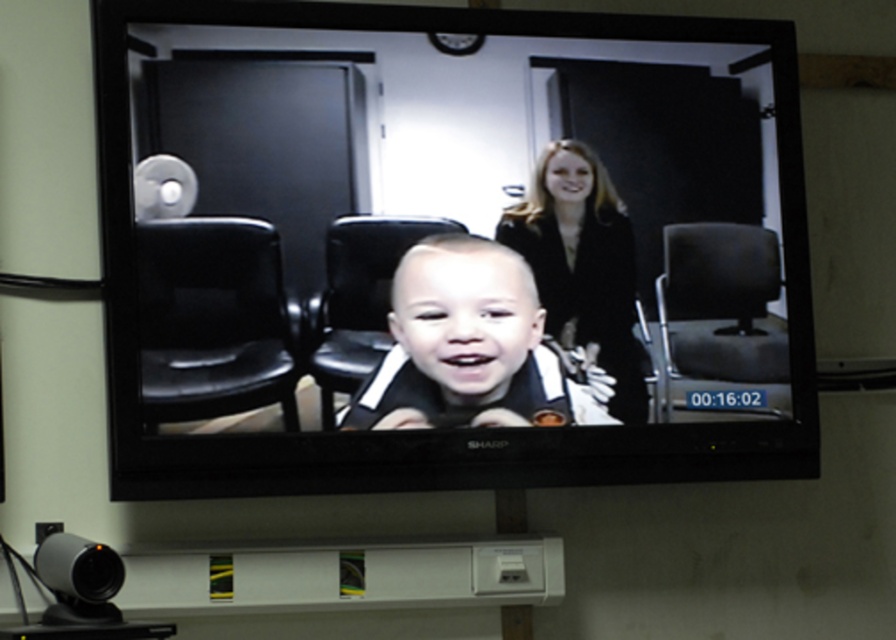
Between black smooth suit at upper center and black leather swivel chair at right, which one appears on the right side from the viewer's perspective?

black leather swivel chair at right

Can you confirm if black smooth suit at upper center is bigger than black leather swivel chair at right?

Correct, black smooth suit at upper center is larger in size than black leather swivel chair at right.

Is point (610, 195) behind point (682, 300)?

No, (610, 195) is closer to viewer.

Locate an element on the screen. The height and width of the screenshot is (640, 896). black smooth suit at upper center is located at coordinates [582, 264].

Where is `smooth skin baby at center`? smooth skin baby at center is located at coordinates (467, 346).

Does smooth skin baby at center have a lesser height compared to black leather swivel chair at right?

Correct, smooth skin baby at center is not as tall as black leather swivel chair at right.

Where is `smooth skin baby at center`? The width and height of the screenshot is (896, 640). smooth skin baby at center is located at coordinates (467, 346).

Who is positioned more to the right, matte black monitor at center or black leather swivel chair at right?

Positioned to the right is black leather swivel chair at right.

Is point (659, 288) farther from viewer compared to point (760, 260)?

No, (659, 288) is closer to viewer.

Where is `matte black monitor at center`? matte black monitor at center is located at coordinates (464, 243).